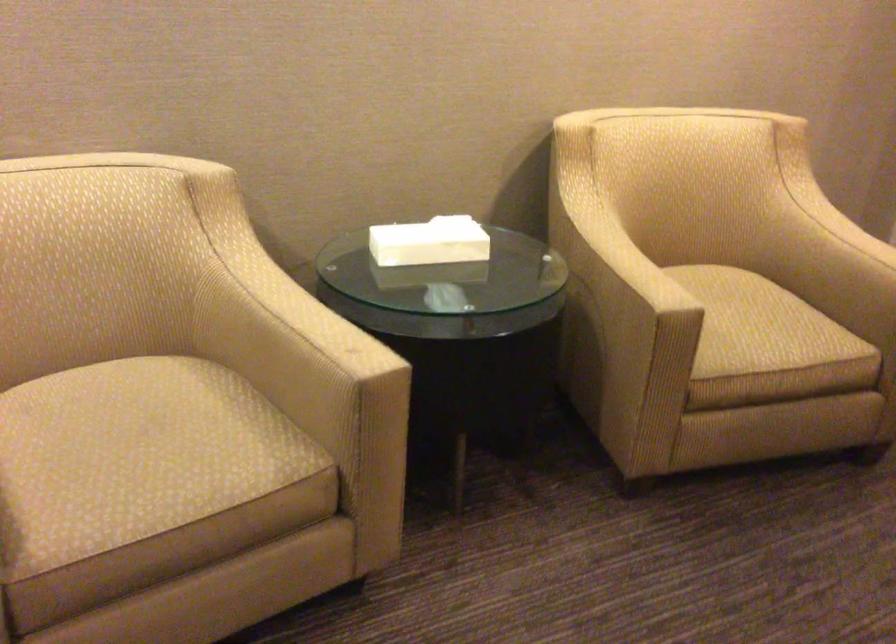
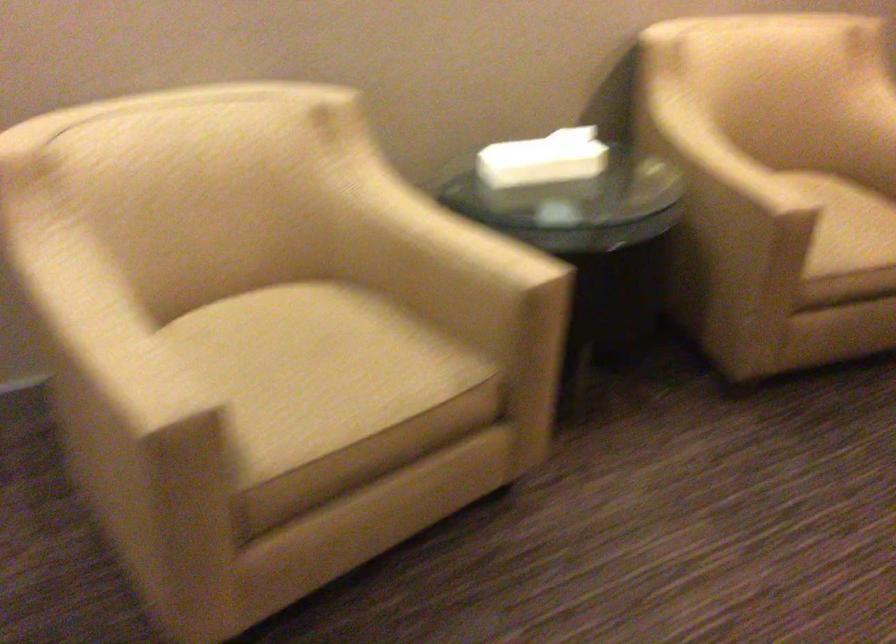
Question: The images are taken continuously from a first-person perspective. In which direction is your viewpoint rotating?

Choices:
 (A) Left
 (B) Right
 (C) Up
 (D) Down

Answer: (D)